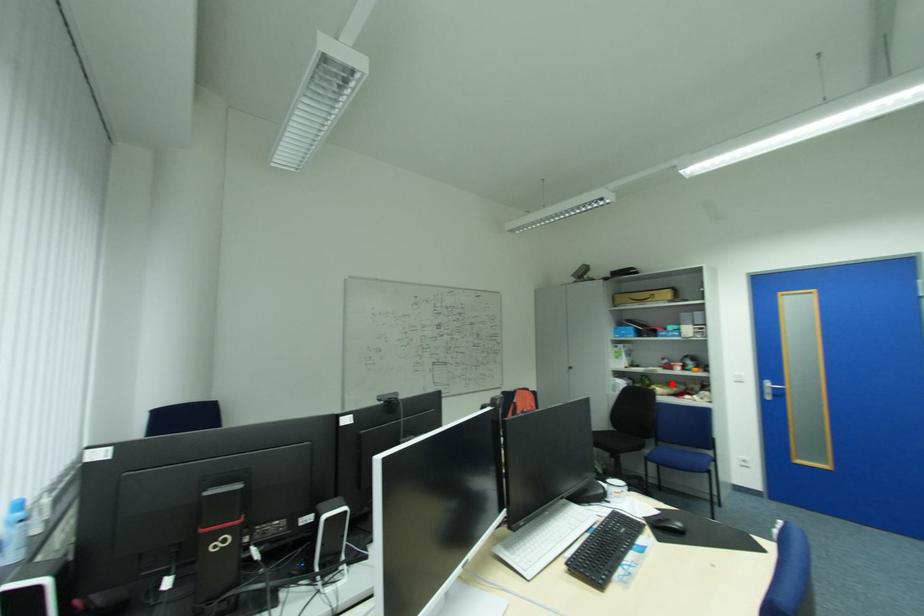
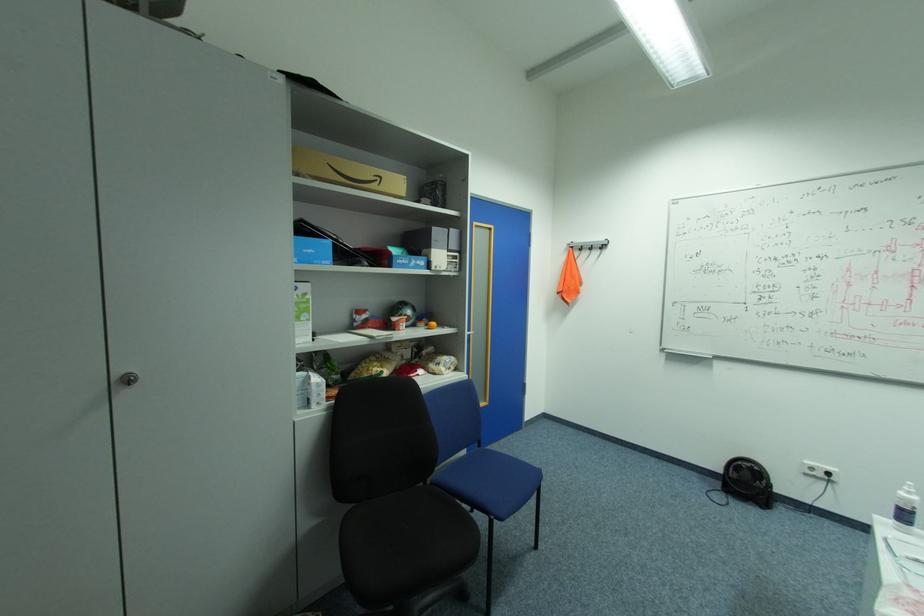
Find the pixel in the second image that matches the highlighted location in the first image.

(380, 358)